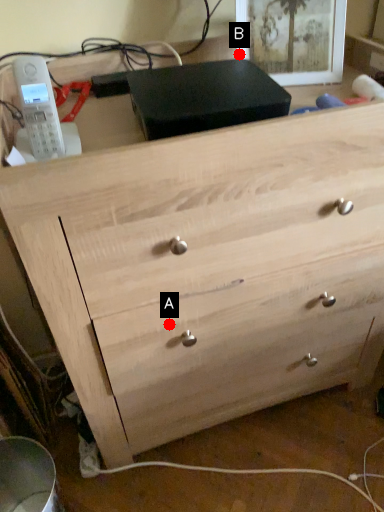
Question: Two points are circled on the image, labeled by A and B beside each circle. Among these points, which one is nearest to the camera?

Choices:
 (A) A is closer
 (B) B is closer

Answer: (A)